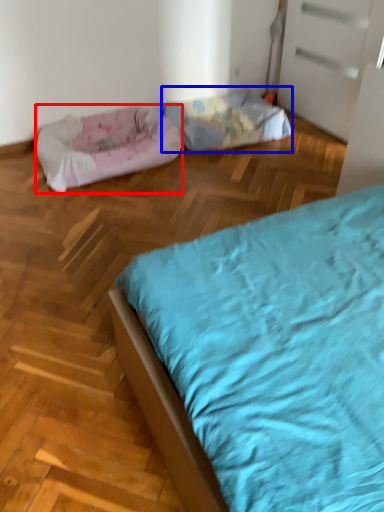
Question: Among these objects, which one is nearest to the camera, dog bed (highlighted by a red box) or dog bed (highlighted by a blue box)?

Choices:
 (A) dog bed
 (B) dog bed

Answer: (A)